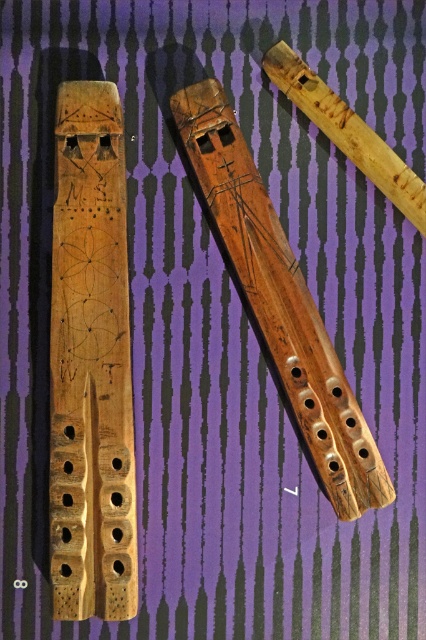
You are standing in front of the three flutes displayed against the purple background. You notice two points marked on the image. Which point is closer to you, point (126, 438) or point (287, 394)?

Point (126, 438) is in front of point (287, 394), so it is closer to you.

From the picture: You are a music student trying to organize these flutes on a shelf. You want to place the natural wood flute at left and the natural wood flute at center in a row from tallest to shortest. Based on the scene, which order should you arrange them in?

The natural wood flute at left is taller than the natural wood flute at center, so you should arrange them from tallest to shortest as natural wood flute at left first, followed by natural wood flute at center.

You are an instrument collector examining the flutes displayed against a purple background with black stripes. You need to place a protective cover over the natural wood flute at left and the natural wood flute at center. Which flute should you cover first if you want to start from the leftmost side?

You should cover the natural wood flute at left first because it is positioned to the left of the natural wood flute at center.